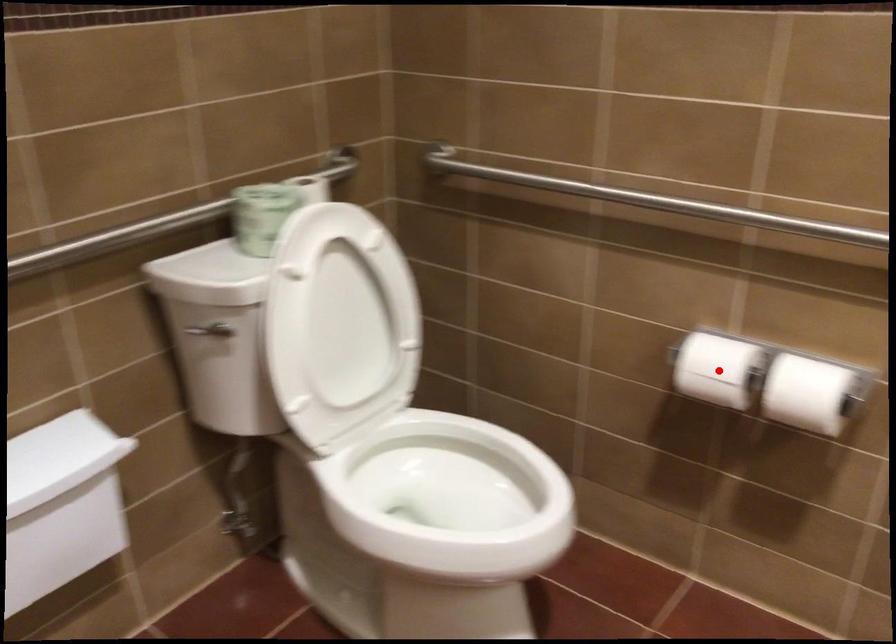
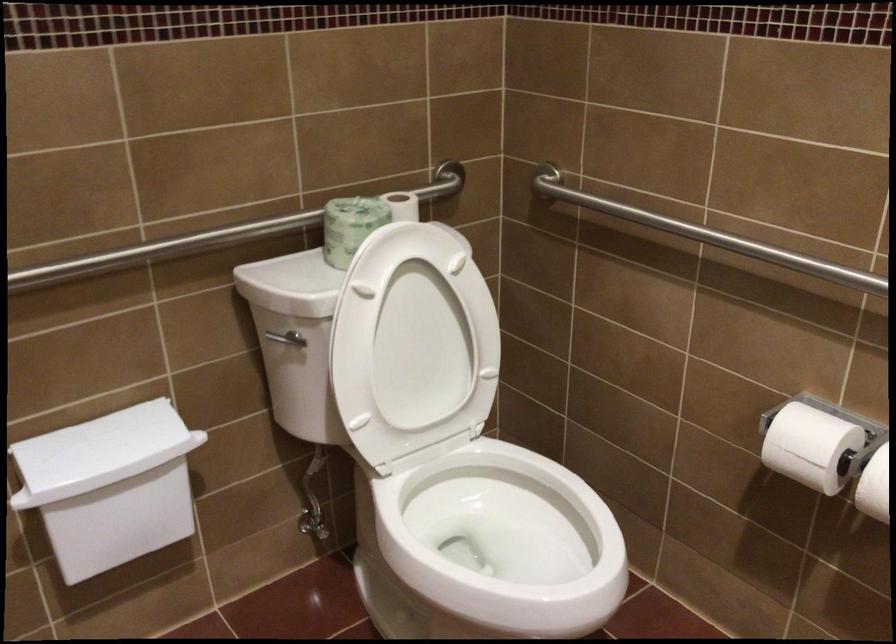
The point at the highlighted location is marked in the first image. Where is the corresponding point in the second image?

(810, 446)